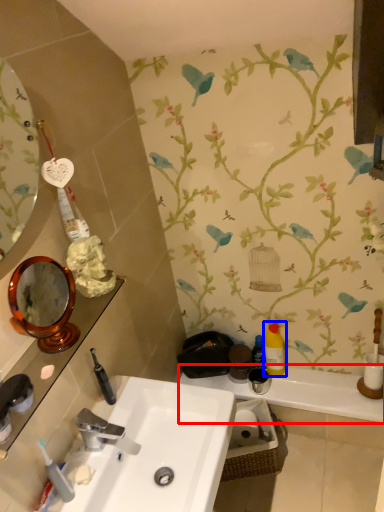
Question: Among these objects, which one is nearest to the camera, counter top (highlighted by a red box) or mouthwash (highlighted by a blue box)?

Choices:
 (A) counter top
 (B) mouthwash

Answer: (A)